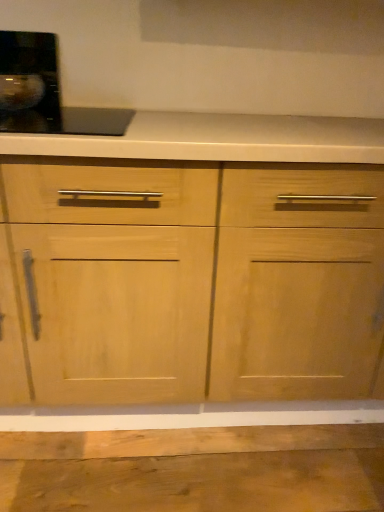
I want to click on black glossy coffee machine at upper left, so pyautogui.click(x=29, y=83).

This screenshot has height=512, width=384. What do you see at coordinates (29, 83) in the screenshot? I see `black glossy coffee machine at upper left` at bounding box center [29, 83].

Where is `black glossy coffee machine at upper left`? black glossy coffee machine at upper left is located at coordinates (29, 83).